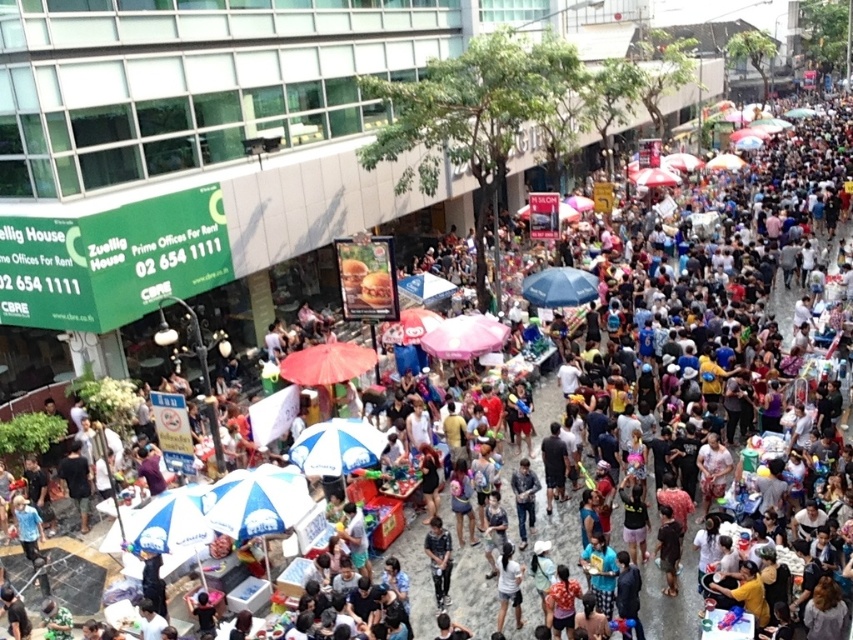
Can you confirm if white matte shirt at center is taller than denim shirt at center?

Incorrect, white matte shirt at center's height is not larger of denim shirt at center's.

Between white matte shirt at center and denim shirt at center, which one is positioned higher?

denim shirt at center is above.

Who is more forward, (512,593) or (515,500)?

Point (512,593) is more forward.

This screenshot has width=853, height=640. Find the location of `white matte shirt at center`. white matte shirt at center is located at coordinates coord(508,586).

Can you confirm if blue fabric umbrella at center is positioned to the left of denim shirt at center?

No, blue fabric umbrella at center is not to the left of denim shirt at center.

What do you see at coordinates (560, 288) in the screenshot? I see `blue fabric umbrella at center` at bounding box center [560, 288].

Find the location of a particular element. Image resolution: width=853 pixels, height=640 pixels. blue fabric umbrella at center is located at coordinates (560, 288).

Can you confirm if blueumbrella at center is taller than pink fabric umbrella at center?

No, blueumbrella at center is not taller than pink fabric umbrella at center.

Does blueumbrella at center appear on the left side of pink fabric umbrella at center?

Correct, you'll find blueumbrella at center to the left of pink fabric umbrella at center.

Who is more distant from viewer, (322, 460) or (436, 352)?

The point (436, 352) is more distant.

This screenshot has height=640, width=853. I want to click on blueumbrella at center, so click(335, 445).